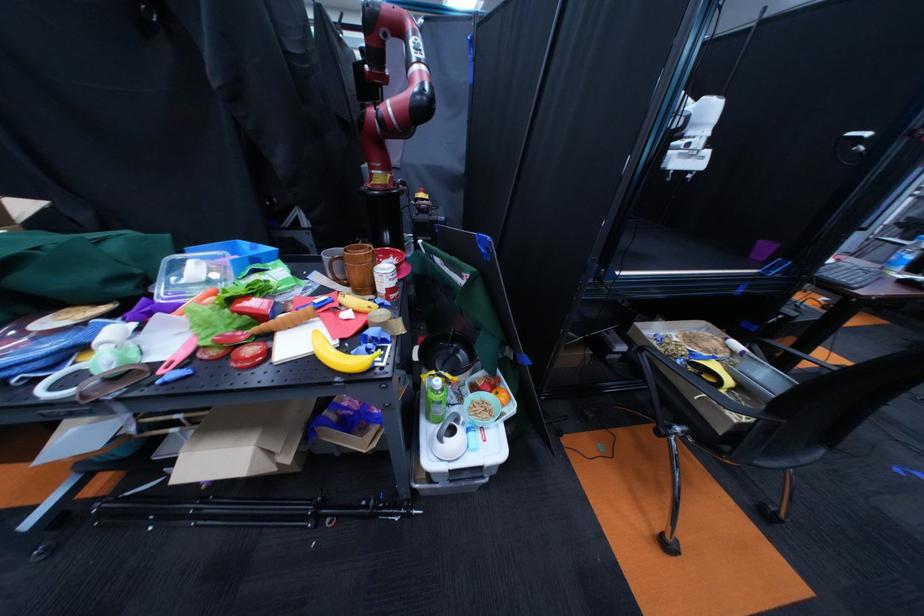
Where would you lift the pink spatula? Please return your answer as a coordinate pair (x, y).

(178, 355)